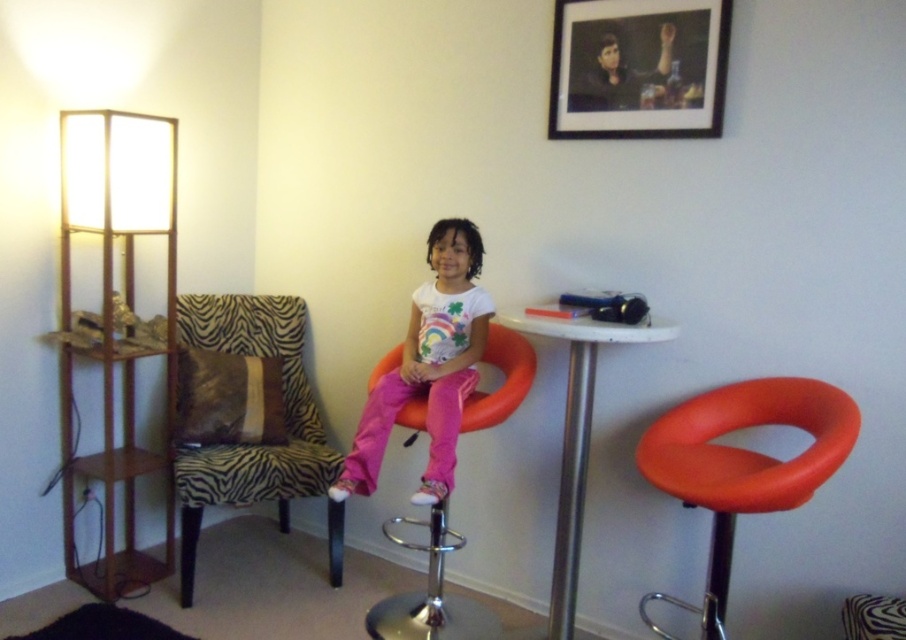
Looking at this image, you are a visitor in the room and want to sit down. There is an orange matte bar stool at center and an orange matte stool at center. Which one is higher?

The orange matte bar stool at center is higher than the orange matte stool at center because it is positioned above it.

Based on the scene description, where exactly is the black matte picture frame at upper center located in terms of coordinates?

The black matte picture frame at upper center is located at coordinates point [638,67].

You are a visitor in the room and want to sit down on the orange matte bar stool at center. Can you sit on it without moving the white glossy table at center?

The orange matte bar stool at center is positioned over the white glossy table at center, so you can sit on it without needing to move the table since it is already placed on top.